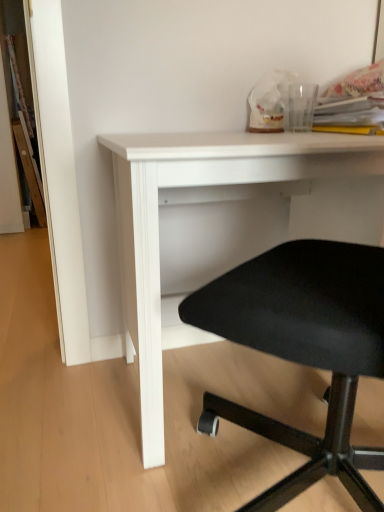
What do you see at coordinates (200, 201) in the screenshot?
I see `white matte desk at center` at bounding box center [200, 201].

You are a GUI agent. You are given a task and a screenshot of the screen. Output one action in this format:
    pyautogui.click(x=<x>, y=<y>)
    Task: Click on the white matte desk at center
    This screenshot has height=512, width=384.
    Given the screenshot: What is the action you would take?
    pyautogui.click(x=200, y=201)

This screenshot has height=512, width=384. I want to click on white matte desk at center, so click(200, 201).